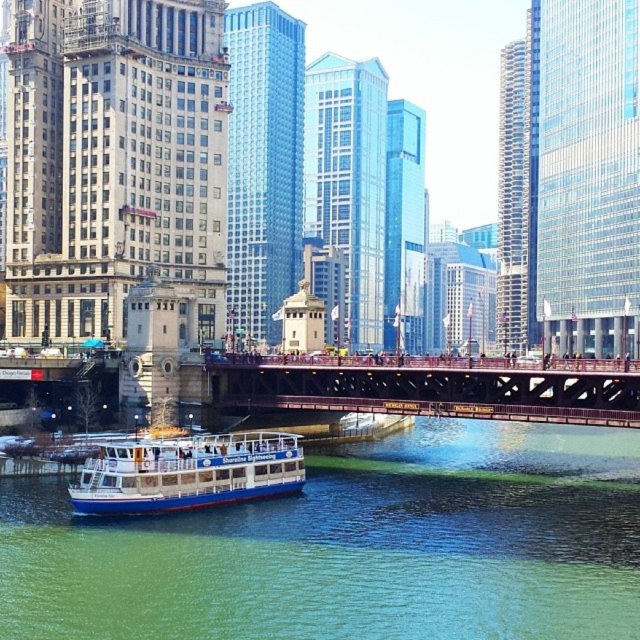
Question: Which of the following is the closest to the observer?

Choices:
 (A) (129, 456)
 (B) (541, 531)

Answer: (B)

Question: Considering the real-world distances, which object is farthest from the brown metal bridge at center?

Choices:
 (A) green water at lower left
 (B) white glossy boat at lower center

Answer: (B)

Question: Which of the following is the closest to the observer?

Choices:
 (A) pos(225,492)
 (B) pos(371,385)
 (C) pos(625,618)

Answer: (C)

Question: Is brown metal bridge at center above white glossy boat at lower center?

Choices:
 (A) yes
 (B) no

Answer: (A)

Question: Is green water at lower left closer to camera compared to brown metal bridge at center?

Choices:
 (A) no
 (B) yes

Answer: (B)

Question: Does green water at lower left appear over brown metal bridge at center?

Choices:
 (A) no
 (B) yes

Answer: (A)